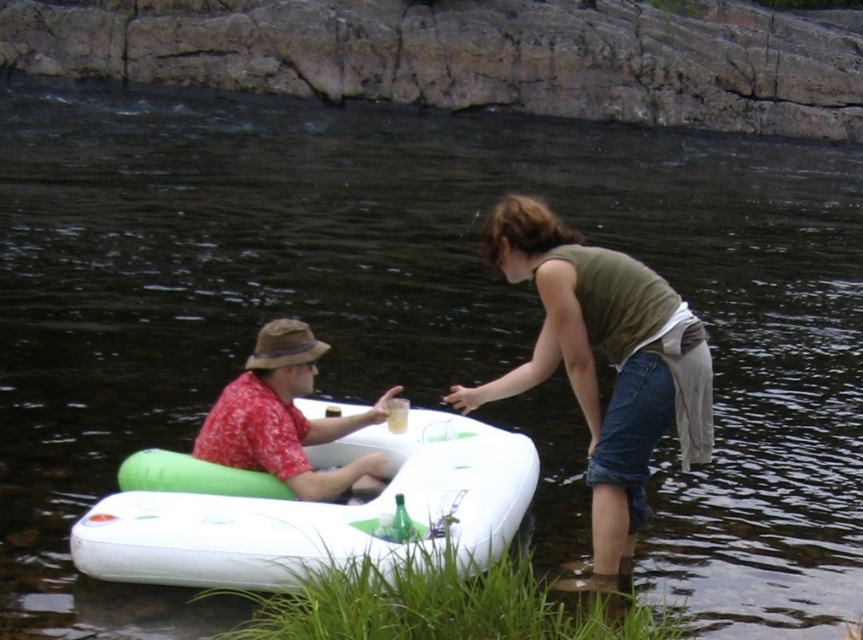
You are a photographer positioned on the riverbank observing the white rubber boat at center and the red floral shirt at center. Which object is closer to the water surface?

The white rubber boat at center is closer to the water surface than the red floral shirt at center because the white rubber boat at center is positioned below the red floral shirt at center.